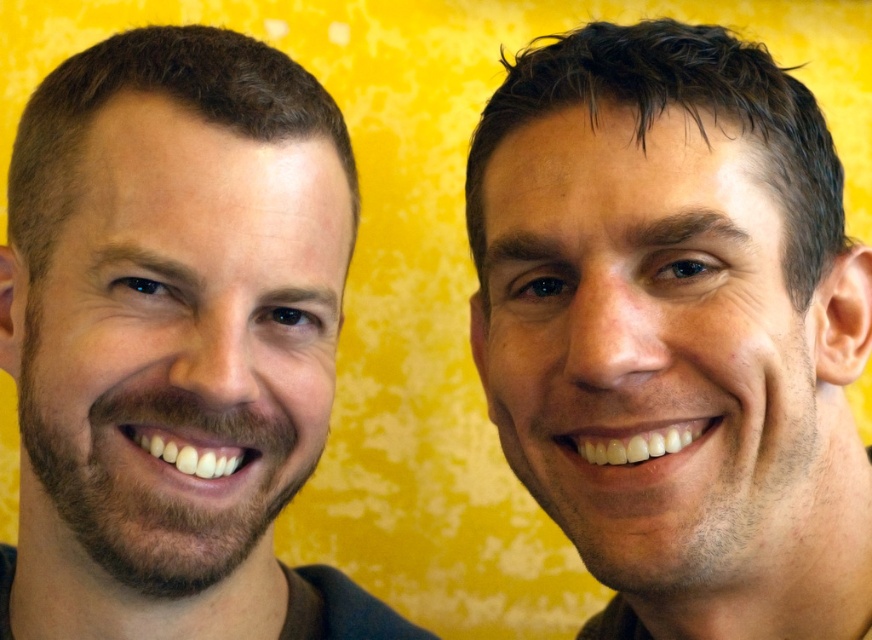
Is smooth skin face at center in front of brown hair at left?

Yes, it is in front of brown hair at left.

Describe the element at coordinates (676, 330) in the screenshot. I see `smooth skin face at center` at that location.

Where is `smooth skin face at center`? This screenshot has width=872, height=640. smooth skin face at center is located at coordinates (676, 330).